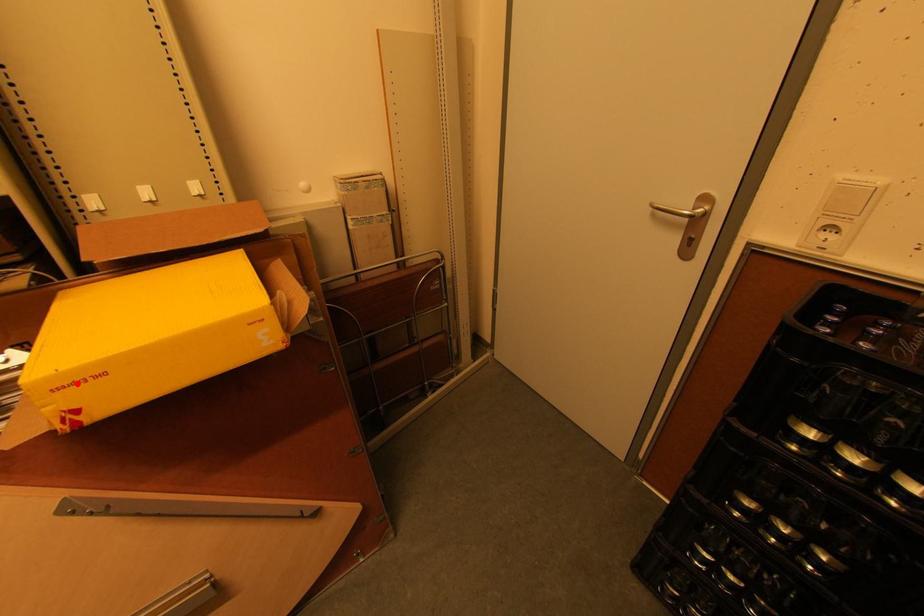
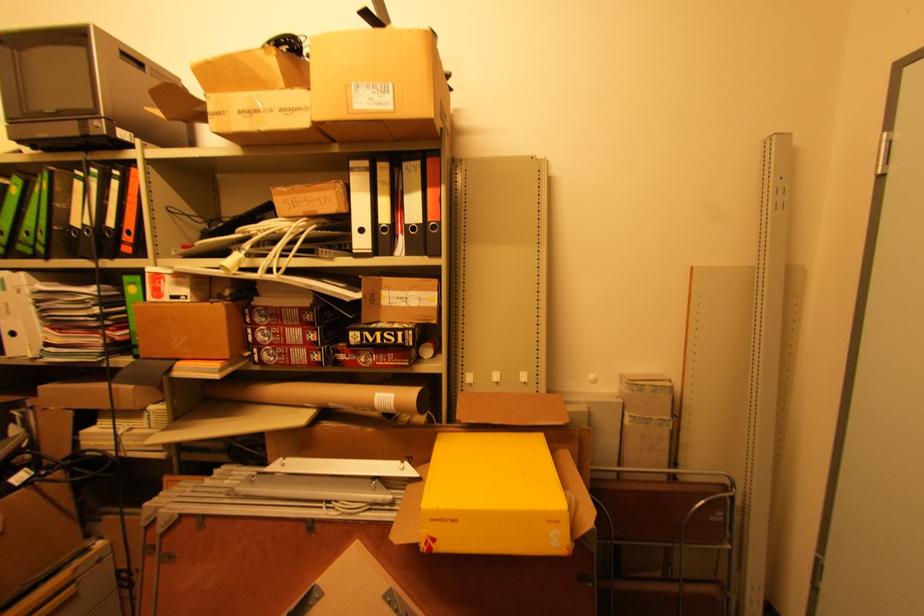
Find the pixel in the second image that matches the highlighted location in the first image.

(444, 521)